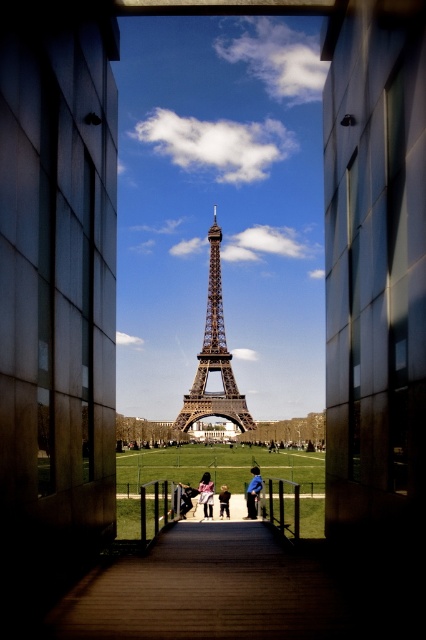
Question: Which of the following is the farthest from the observer?

Choices:
 (A) (207, 340)
 (B) (258, 476)
 (C) (222, 506)

Answer: (A)

Question: Which of the following is the farthest from the observer?

Choices:
 (A) (195, 376)
 (B) (204, 509)

Answer: (A)

Question: Among these points, which one is farthest from the camera?

Choices:
 (A) (252, 513)
 (B) (201, 394)

Answer: (A)

Question: From the image, what is the correct spatial relationship of blue fabric pants at center in relation to light blue jeans at center?

Choices:
 (A) left
 (B) right

Answer: (B)

Question: Can you confirm if blue fabric pants at center is smaller than matte pink dress at center?

Choices:
 (A) yes
 (B) no

Answer: (B)

Question: Can you confirm if matte pink dress at center is wider than light blue jeans at center?

Choices:
 (A) yes
 (B) no

Answer: (A)